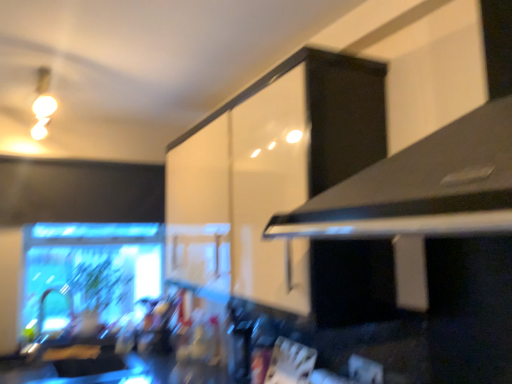
Question: From their relative heights in the image, would you say matte white bulb at upper left is taller or shorter than white glossy cabinet at upper center?

Choices:
 (A) short
 (B) tall

Answer: (A)

Question: From the image's perspective, relative to white glossy cabinet at upper center, is matte white bulb at upper left above or below?

Choices:
 (A) above
 (B) below

Answer: (A)

Question: Estimate the real-world distances between objects in this image. Which object is farther from the white glossy cabinet at upper center?

Choices:
 (A) matte white bulb at upper left
 (B) black matte exhaust hood at upper right

Answer: (A)

Question: Based on their relative distances, which object is farther from the matte white bulb at upper left?

Choices:
 (A) black matte exhaust hood at upper right
 (B) white glossy cabinet at upper center

Answer: (A)